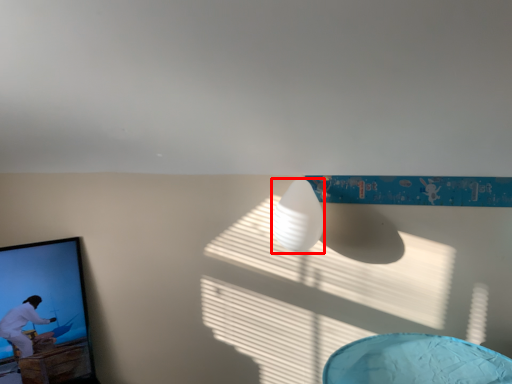
Question: From the image's perspective, considering the relative positions of lamp (annotated by the red box) and picture frame in the image provided, where is lamp (annotated by the red box) located with respect to the staircase?

Choices:
 (A) above
 (B) below

Answer: (A)